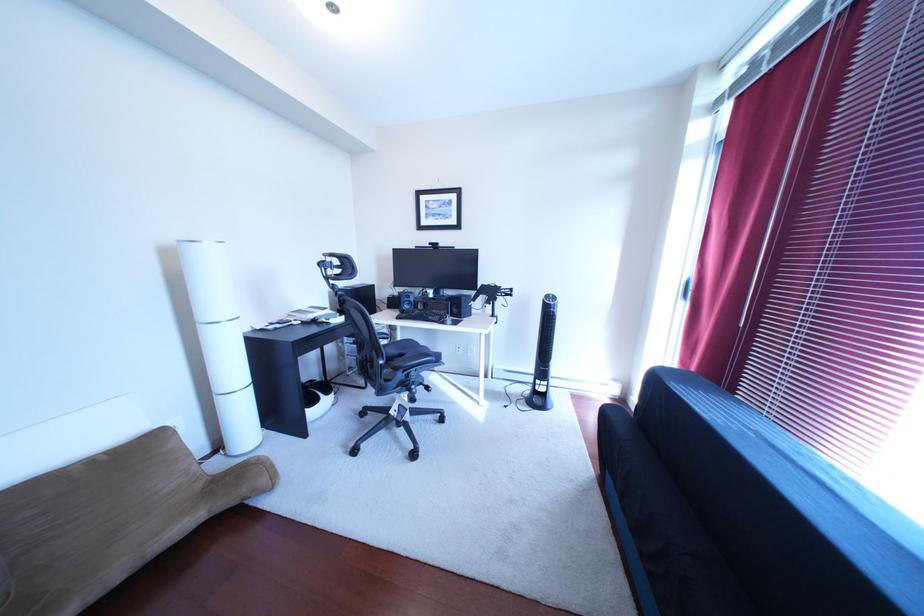
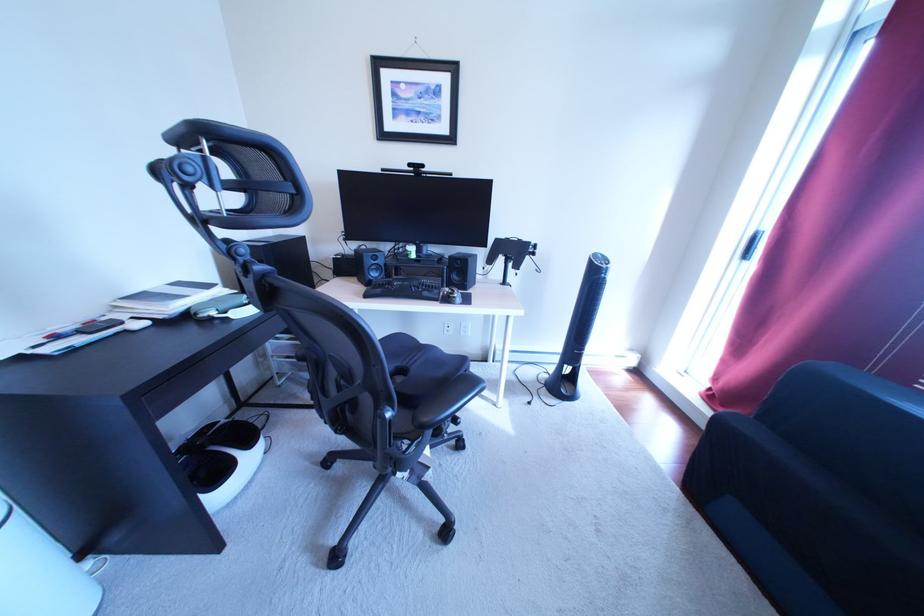
Question: Based on the continuous images, in which direction is the camera rotating? Reply with the corresponding letter.

Choices:
 (A) Left
 (B) Right
 (C) Up
 (D) Down

Answer: (B)